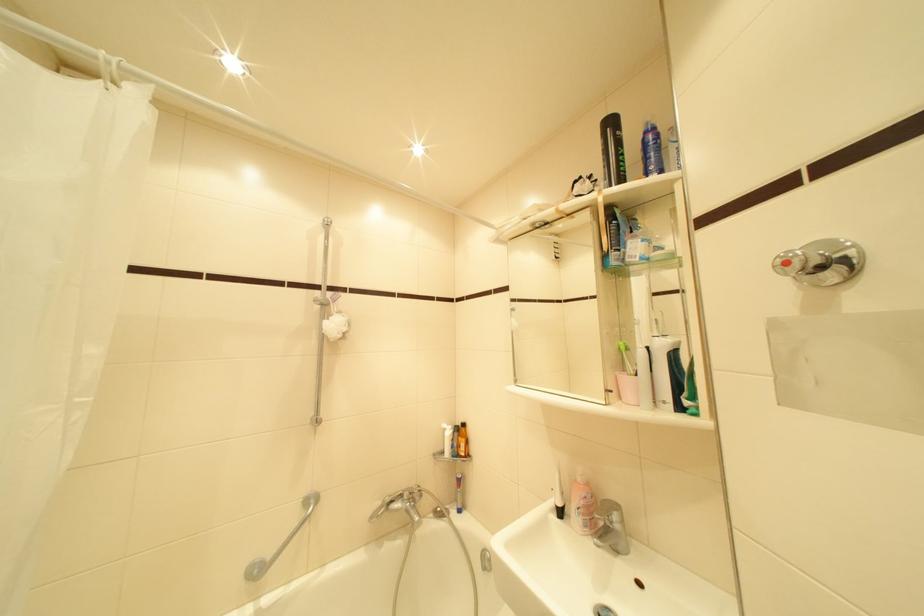
The image size is (924, 616). What do you see at coordinates (618, 533) in the screenshot?
I see `the sink faucet handle` at bounding box center [618, 533].